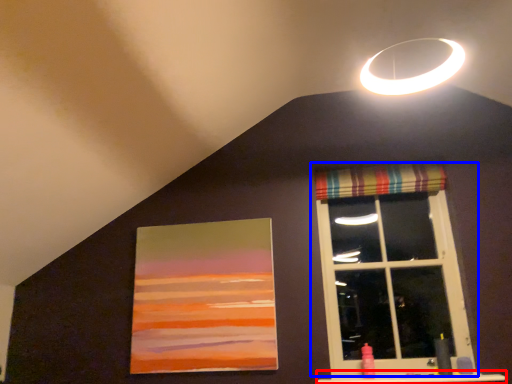
Question: Which of the following is the closest to the observer, window sill (highlighted by a red box) or window (highlighted by a blue box)?

Choices:
 (A) window sill
 (B) window

Answer: (A)